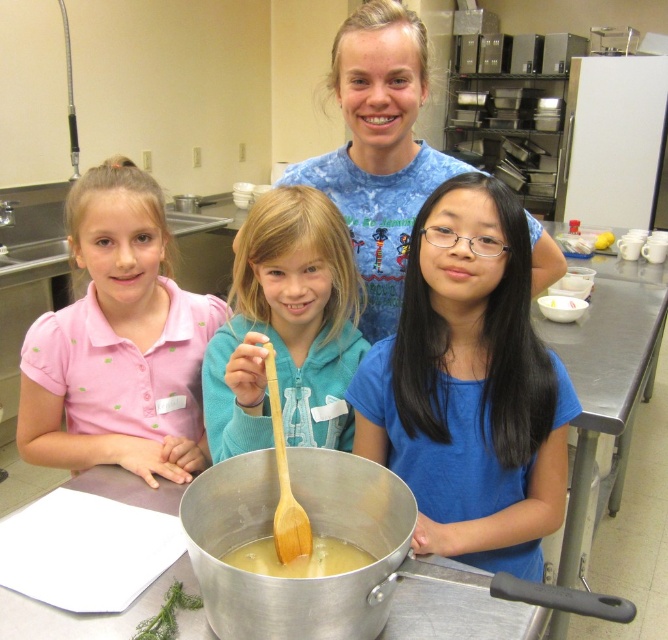
Question: Which object is the closest to the yellow matte liquid at center?

Choices:
 (A) blue matte shirt at center
 (B) blue cotton shirt at upper center

Answer: (A)

Question: Which point is closer to the camera?

Choices:
 (A) click(x=605, y=232)
 (B) click(x=389, y=214)

Answer: (B)

Question: Is the position of wooden spoon at center more distant than that of yellow matte cupcake at center?

Choices:
 (A) yes
 (B) no

Answer: (B)

Question: Is blue matte shirt at center thinner than pink cotton shirt at left?

Choices:
 (A) yes
 (B) no

Answer: (A)

Question: Which of the following is the closest to the observer?

Choices:
 (A) (98, 445)
 (B) (595, 250)

Answer: (A)

Question: Does pink cotton shirt at left appear over yellow matte liquid at center?

Choices:
 (A) yes
 (B) no

Answer: (A)